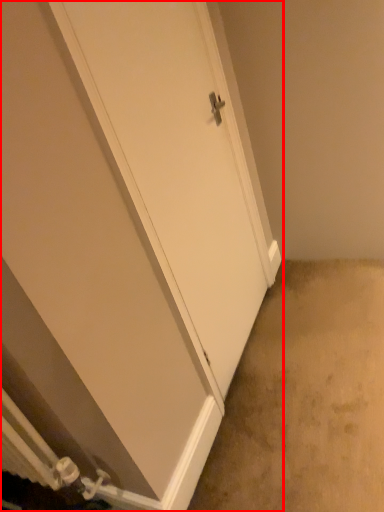
Question: Where is door (annotated by the red box) located in relation to concrete in the image?

Choices:
 (A) left
 (B) right

Answer: (A)